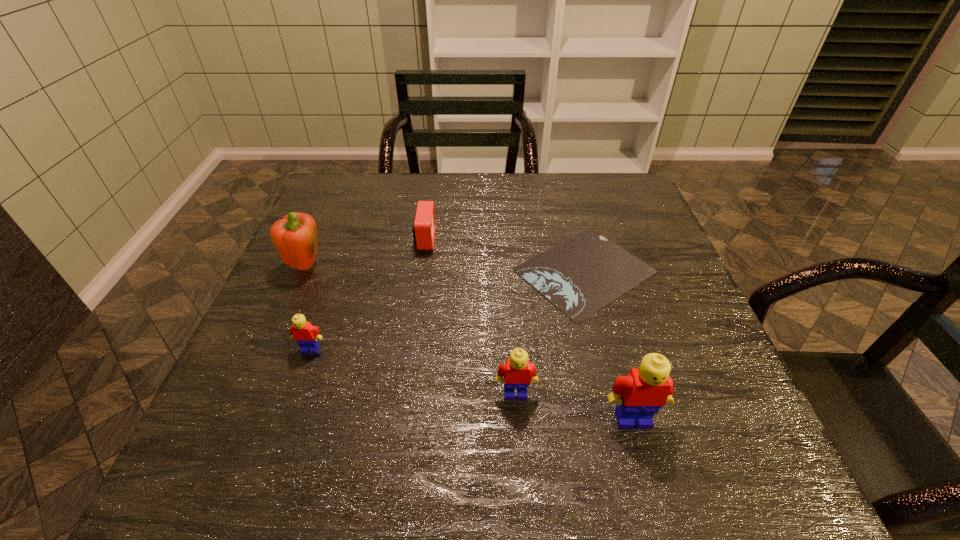
Locate an element on the screen. Image resolution: width=960 pixels, height=540 pixels. free space located on the front of the shortest object is located at coordinates (614, 387).

In order to click on vacant space located 0.350m on the front-facing side of the fourth object from right to left in this screenshot , I will do `click(568, 239)`.

This screenshot has width=960, height=540. What are the coordinates of `vacant space situated on the back of the pepper` in the screenshot? It's located at (325, 219).

I want to click on Lego at the left edge, so click(x=306, y=335).

The width and height of the screenshot is (960, 540). Identify the location of pepper that is at the left edge. (295, 236).

Where is `Lego that is at the right edge`? This screenshot has height=540, width=960. Lego that is at the right edge is located at coordinates (641, 394).

Identify the location of mousepad at the right edge. (581, 275).

The width and height of the screenshot is (960, 540). In order to click on object that is at the near right corner in this screenshot , I will do `click(641, 394)`.

Find the location of `vacant space at the far edge of the desktop`. vacant space at the far edge of the desktop is located at coordinates (533, 217).

Locate an element on the screen. vacant space at the near edge is located at coordinates (546, 392).